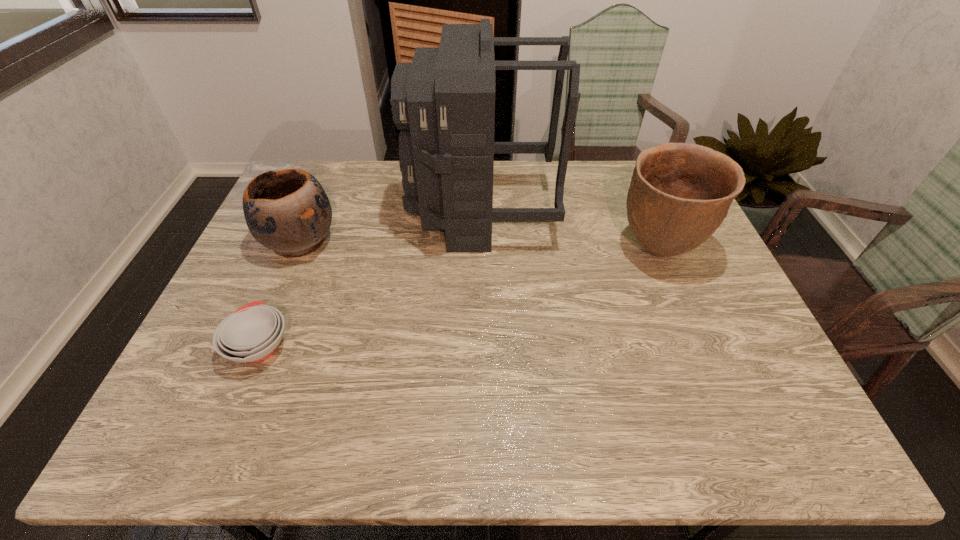
At what (x,y) coordinates should I click in order to perform the action: click on the third object from left to right. Please return your answer as a coordinate pair (x, y). Looking at the image, I should click on (444, 101).

This screenshot has width=960, height=540. I want to click on backpack, so point(444,101).

Find the location of a particular element. the second tallest object is located at coordinates (680, 193).

Locate an element on the screen. The height and width of the screenshot is (540, 960). the rightmost object is located at coordinates (680, 193).

Locate an element on the screen. This screenshot has height=540, width=960. the second shortest object is located at coordinates (287, 211).

I want to click on the left pottery, so click(x=287, y=211).

You are a GUI agent. You are given a task and a screenshot of the screen. Output one action in this format:
    pyautogui.click(x=<x>, y=<y>)
    Task: Click on the nearest object
    This screenshot has height=540, width=960.
    Given the screenshot: What is the action you would take?
    [252, 333]

You are a GUI agent. You are given a task and a screenshot of the screen. Output one action in this format:
    pyautogui.click(x=<x>, y=<y>)
    Task: Click on the soup bowl
    This screenshot has height=540, width=960.
    Given the screenshot: What is the action you would take?
    pyautogui.click(x=252, y=333)

The width and height of the screenshot is (960, 540). Identify the location of vacant space located 0.310m on the front compartment of the backpack. (309, 212).

This screenshot has width=960, height=540. I want to click on vacant space situated 0.260m on the front compartment of the backpack, so click(325, 212).